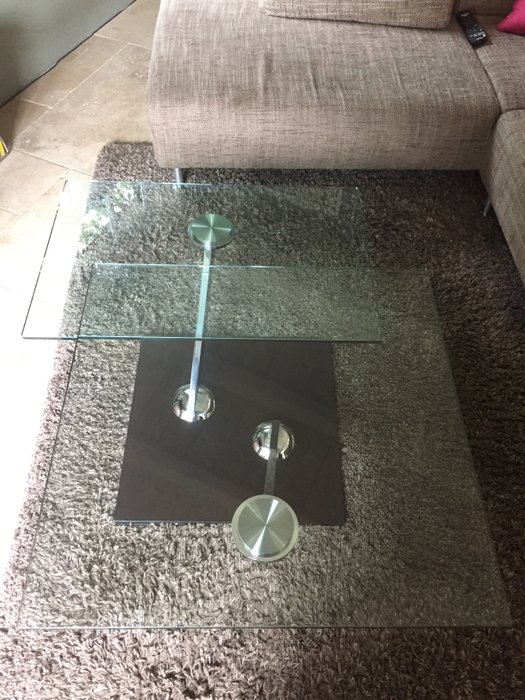
What are the coordinates of `red throw pillow` in the screenshot? It's located at (520, 15).